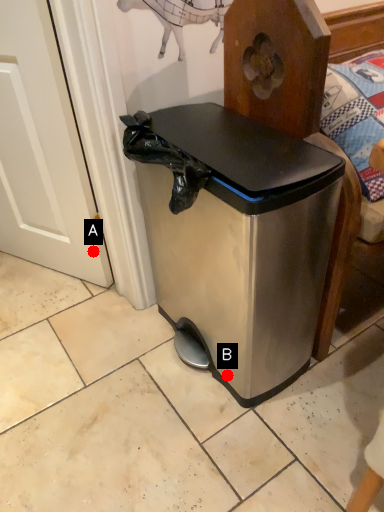
Question: Two points are circled on the image, labeled by A and B beside each circle. Among these points, which one is nearest to the camera?

Choices:
 (A) A is closer
 (B) B is closer

Answer: (B)